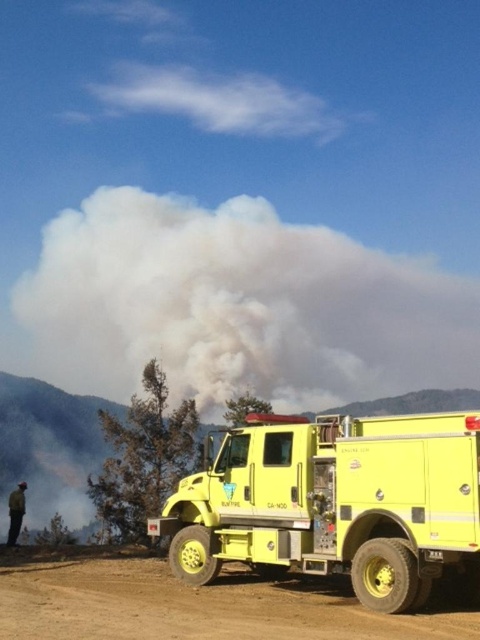
You are a firefighter standing on the brown dirt track at lower center and need to reach the camouflage jacket at lower left. Which direction should you move to get there?

The camouflage jacket at lower left is farther from the viewer than the brown dirt track at lower center. Therefore, to reach it, you should move forward towards the jacket since it is located behind the track in the scene.

You are a firefighter assessing the scene. You need to move the yellow matte fire truck at center to a safer location away from the brown dirt track at lower center. Is the fire truck currently on the dirt track?

The yellow matte fire truck at center is positioned over brown dirt track at lower center, so yes, the fire truck is currently on the dirt track and needs to be moved to a safer area.

You are a firefighter needing to quickly grab your camouflage jacket at lower left before boarding the yellow matte fire truck at center. Given that you can run at 10 feet per second, how many seconds will it take you to reach the jacket from your current position?

The yellow matte fire truck at center is 34.10 feet away from the camouflage jacket at lower left. Since you can run at 10 feet per second, it will take approximately 3.41 seconds to reach the jacket.